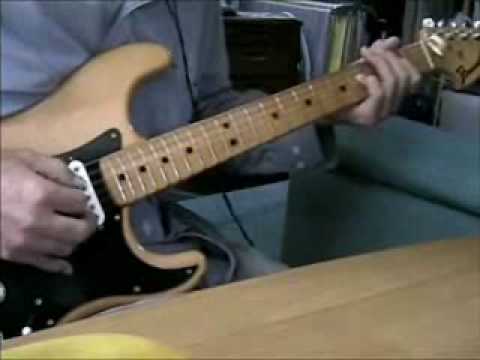
This screenshot has height=360, width=480. Identify the location of couch. (418, 164).